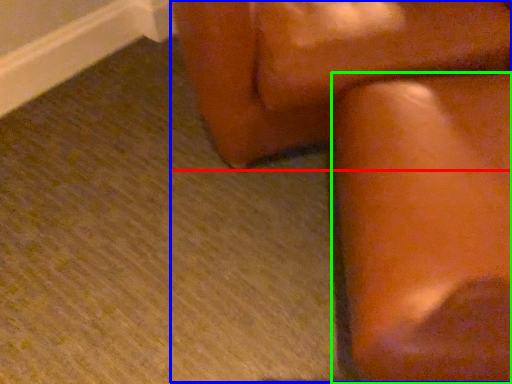
Question: Which is farther away from furniture (highlighted by a red box)? rocking chair (highlighted by a blue box) or furniture (highlighted by a green box)?

Choices:
 (A) rocking chair
 (B) furniture

Answer: (B)